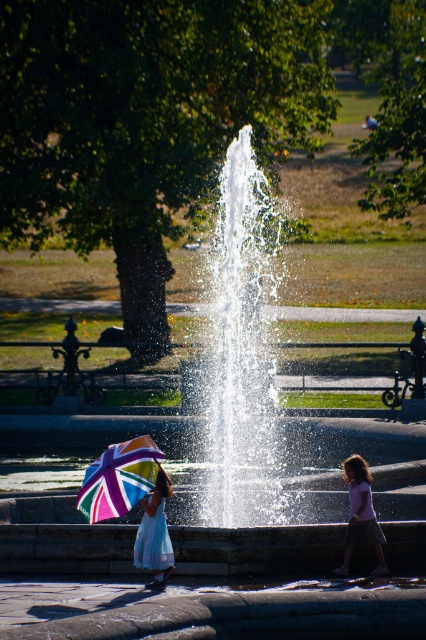
Is point (95, 506) positioned before point (362, 531)?

Yes.

Can you confirm if rainbow-patterned fabric umbrella at left is positioned below pink cotton shirt at center?

No.

Is point (117, 499) more distant than point (362, 481)?

No, (117, 499) is closer to viewer.

Identify the location of rainbow-patterned fabric umbrella at left. The height and width of the screenshot is (640, 426). (118, 477).

What do you see at coordinates (118, 477) in the screenshot? I see `rainbow-patterned fabric umbrella at left` at bounding box center [118, 477].

Is point (129, 508) positioned after point (141, 528)?

No, (129, 508) is closer to viewer.

The height and width of the screenshot is (640, 426). Find the location of `rainbow-patterned fabric umbrella at left`. rainbow-patterned fabric umbrella at left is located at coordinates point(118,477).

Does pink cotton shirt at center have a greater height compared to light blue satin dress at lower left?

No.

Between pink cotton shirt at center and light blue satin dress at lower left, which one is positioned lower?

light blue satin dress at lower left is lower down.

Describe the element at coordinates (360, 516) in the screenshot. I see `pink cotton shirt at center` at that location.

Locate an element on the screen. Image resolution: width=426 pixels, height=640 pixels. pink cotton shirt at center is located at coordinates (360, 516).